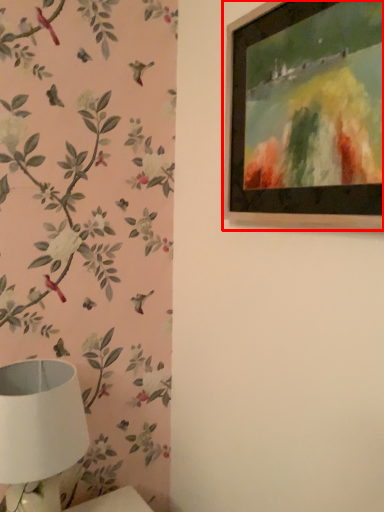
Question: From the image's perspective, what is the correct spatial positioning of picture frame (annotated by the red box) in reference to table lamp?

Choices:
 (A) above
 (B) below

Answer: (A)